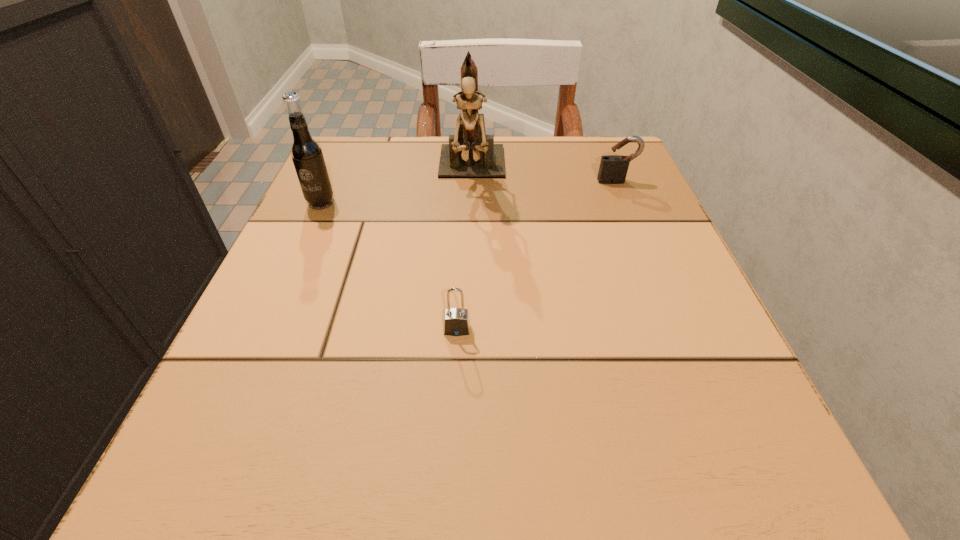
In the image, there is a desktop. Where is `vacant space at the left edge`? The image size is (960, 540). vacant space at the left edge is located at coordinates (368, 280).

Where is `vacant space at the right edge of the desktop`? Image resolution: width=960 pixels, height=540 pixels. vacant space at the right edge of the desktop is located at coordinates (634, 311).

The image size is (960, 540). I want to click on free space at the far left corner of the desktop, so click(344, 136).

The image size is (960, 540). Find the location of `vacant space at the near left corner`. vacant space at the near left corner is located at coordinates (281, 478).

The width and height of the screenshot is (960, 540). Find the location of `vacant space that is in between the tallest object and the nearer padlock`. vacant space that is in between the tallest object and the nearer padlock is located at coordinates (465, 251).

The width and height of the screenshot is (960, 540). In order to click on vacant region between the leftmost object and the rightmost object in this screenshot , I will do `click(468, 192)`.

In order to click on vacant space that's between the shortest object and the figurine in this screenshot , I will do `click(465, 251)`.

Where is `vacant area that lies between the farther padlock and the tallest object`? This screenshot has height=540, width=960. vacant area that lies between the farther padlock and the tallest object is located at coordinates (544, 177).

Locate an element on the screen. free space between the tallest object and the second tallest object is located at coordinates (396, 187).

You are a GUI agent. You are given a task and a screenshot of the screen. Output one action in this format:
    pyautogui.click(x=<x>, y=<y>)
    Task: Click on the vacant point located between the shortest object and the figurine
    The image size is (960, 540).
    Given the screenshot: What is the action you would take?
    pyautogui.click(x=465, y=251)